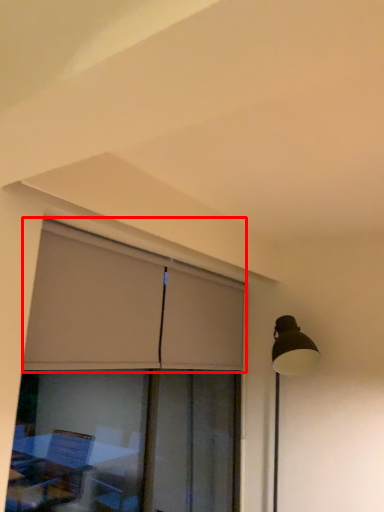
Question: Observing the image, what is the correct spatial positioning of curtain (annotated by the red box) in reference to window?

Choices:
 (A) left
 (B) right

Answer: (B)